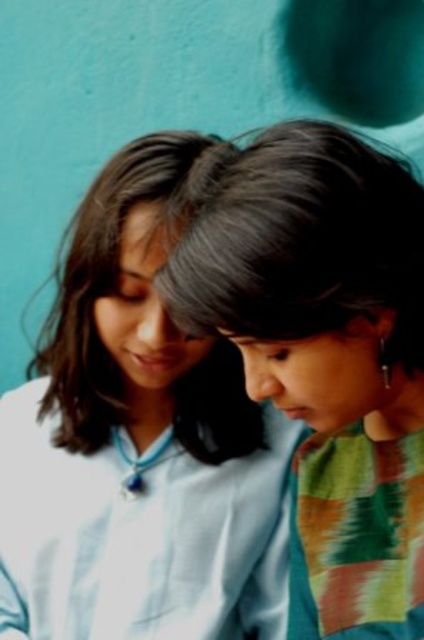
Is point (190, 188) more distant than point (303, 188)?

Yes, it is.

Who is positioned more to the left, white glossy shirt at center or smooth black hair at center?

white glossy shirt at center

Which is in front, point (102, 285) or point (292, 292)?

Point (292, 292)

Identify the location of white glossy shirt at center. The height and width of the screenshot is (640, 424). (136, 440).